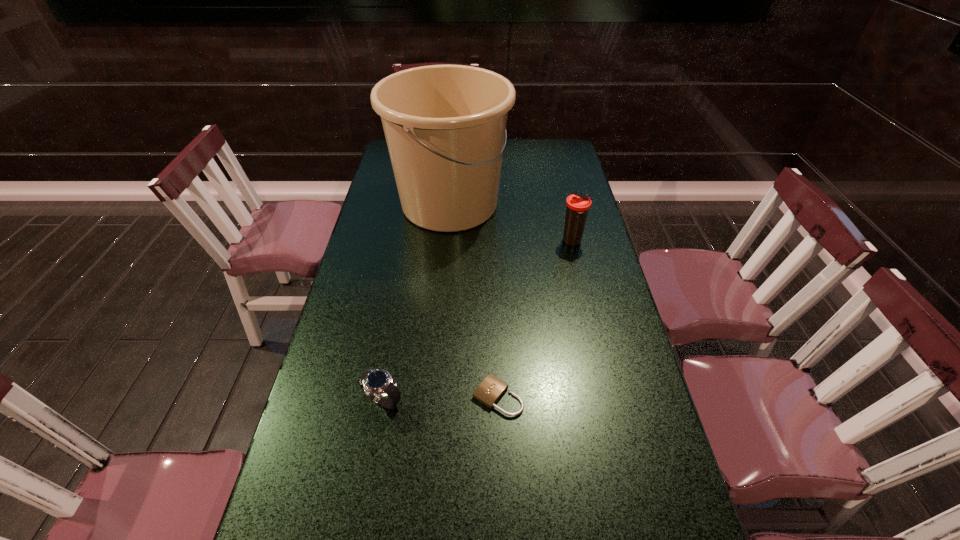
Where is `free space that satisfies the following two spatial constraints: 1. on the back side of the shortest object; 2. on the right side of the watch`? The height and width of the screenshot is (540, 960). free space that satisfies the following two spatial constraints: 1. on the back side of the shortest object; 2. on the right side of the watch is located at coordinates (383, 396).

Image resolution: width=960 pixels, height=540 pixels. I want to click on vacant region that satisfies the following two spatial constraints: 1. on the back side of the rightmost object; 2. on the left side of the shortest object, so click(x=492, y=241).